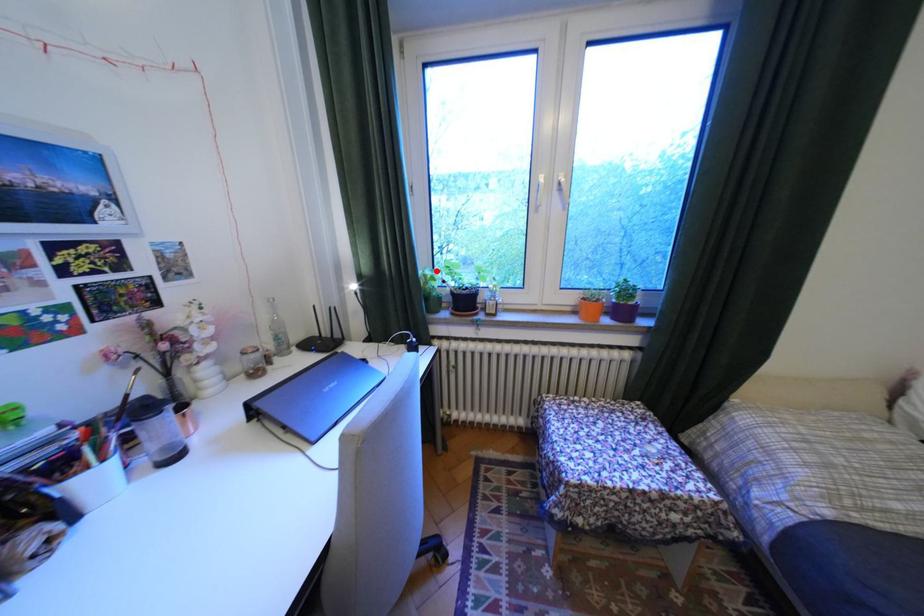
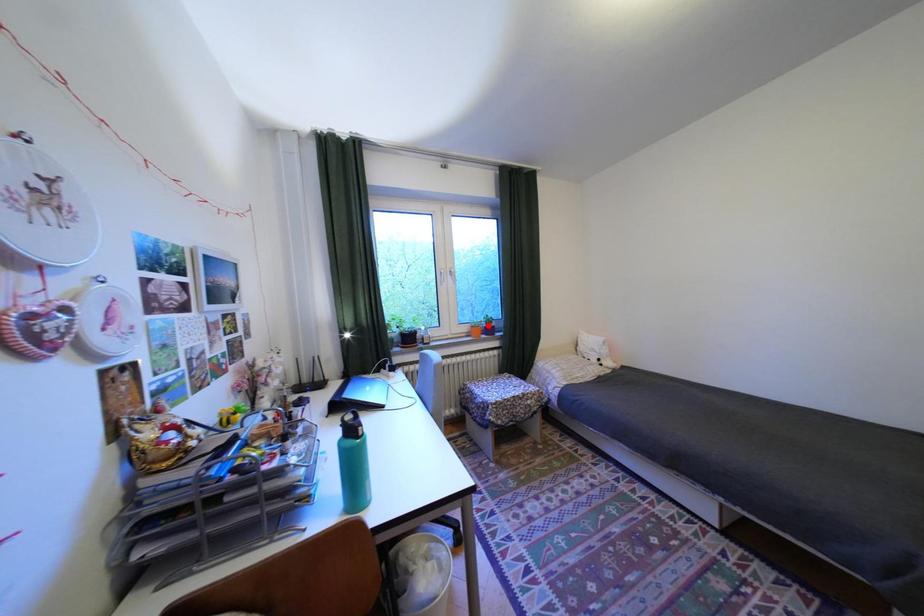
I am providing you with two images of the same scene from different viewpoints. A red point is marked on the first image and another point is marked on the second image. Is the marked point in image1 the same physical position as the marked point in image2?

No